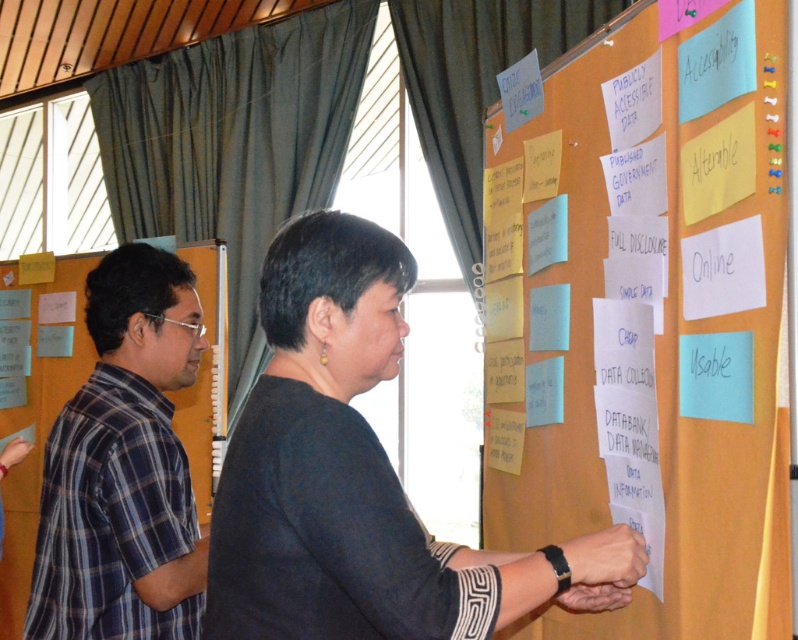
Is dark gray sweater at center in front of black leather watch at center?

Yes.

Which is above, dark gray sweater at center or black leather watch at center?

dark gray sweater at center

Which is behind, point (297, 228) or point (635, 563)?

Point (635, 563)

I want to click on dark gray sweater at center, so click(346, 472).

Can you confirm if light brown corkboard at upper right is wider than dark gray sweater at center?

No, light brown corkboard at upper right is not wider than dark gray sweater at center.

Which is behind, point (733, 342) or point (287, 435)?

The point (733, 342) is more distant.

Where is `light brown corkboard at upper right`? light brown corkboard at upper right is located at coordinates click(x=646, y=316).

Is point (765, 150) less distant than point (593, 545)?

Yes, it is.

Does light brown corkboard at upper right come behind black leather watch at center?

No, it is in front of black leather watch at center.

Between point (737, 452) and point (585, 552), which one is positioned behind?

The point (585, 552) is behind.

At what (x,y) coordinates should I click in order to perform the action: click on light brown corkboard at upper right. Please return your answer as a coordinate pair (x, y). This screenshot has width=798, height=640. Looking at the image, I should click on (646, 316).